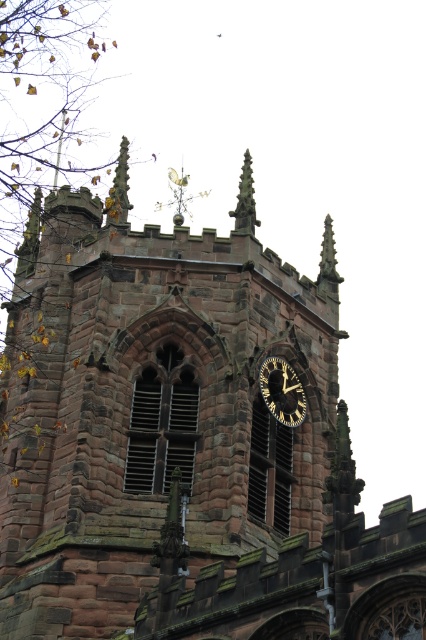
In the scene shown: What is the color of the clock face at the point specified by coordinates (x=282, y=392)?

The clock face at the point specified by coordinates (x=282, y=392) has a black background with gold colored hands and numbers.